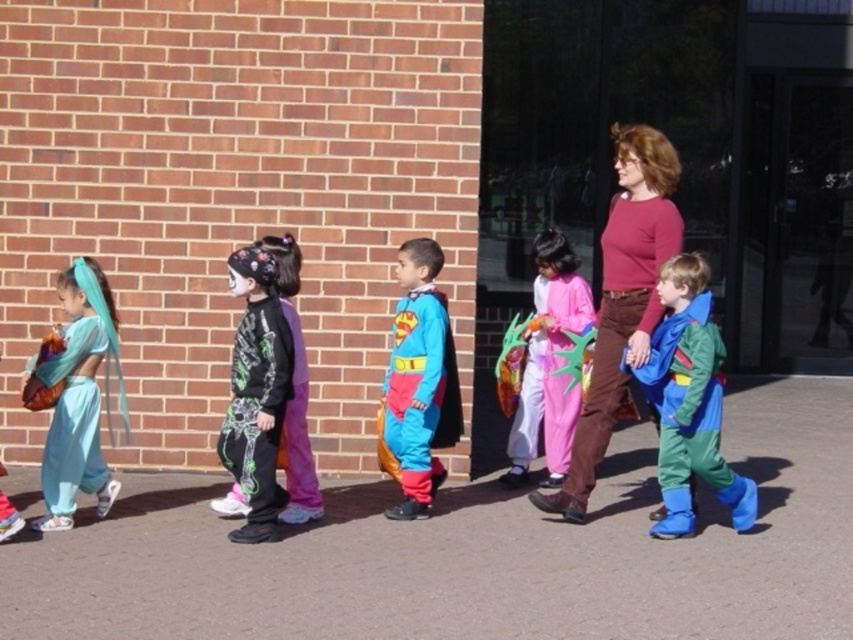
Consider the image. Who is lower down, brown asphalt at lower center or matte blue fabric dress at left?

Positioned lower is brown asphalt at lower center.

Does point (546, 516) come closer to viewer compared to point (83, 337)?

No, it is not.

Does point (558, 545) lie in front of point (62, 326)?

That is False.

Locate an element on the screen. This screenshot has height=640, width=853. brown asphalt at lower center is located at coordinates (474, 554).

Between matte pink sweater at center and pink fabric costume at center, which one appears on the left side from the viewer's perspective?

pink fabric costume at center

Is matte pink sweater at center further to the viewer compared to pink fabric costume at center?

No, matte pink sweater at center is closer to the viewer.

Is point (566, 504) positioned in front of point (548, 385)?

Yes.

The image size is (853, 640). I want to click on matte pink sweater at center, so click(622, 298).

In the scene shown: Is brown asphalt at lower center above superman costume at center?

No, brown asphalt at lower center is not above superman costume at center.

Can you confirm if brown asphalt at lower center is smaller than superman costume at center?

Incorrect, brown asphalt at lower center is not smaller in size than superman costume at center.

Between point (683, 624) and point (427, 243), which one is positioned behind?

Point (427, 243)

Identify the location of brown asphalt at lower center. (474, 554).